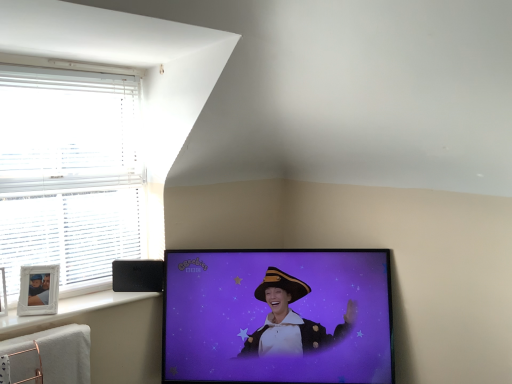
Identify the location of free region on the left part of black plastic speaker at lower left. (109, 293).